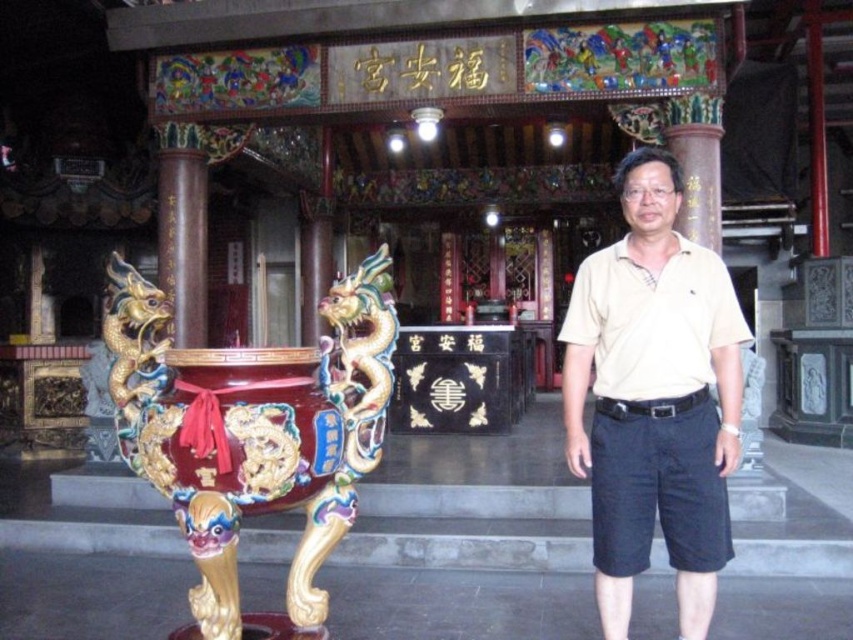
You are a visitor in the temple and want to take a photo of the beige cotton polo shirt at center and the brown polished wood pillar at center. Which object should you focus on first if you want to capture both in a single shot without moving the camera?

The beige cotton polo shirt at center is much taller than the brown polished wood pillar at center, so you should focus on the beige cotton polo shirt at center first to ensure both are in frame.

You are a temple visitor who wants to light an incense stick. The glossy ceramic incense burner at center is your target. However, you need to know if you can reach it without moving past the brown polished wood pillar at center. Your outstretched arm can reach 1.5 meters. Can you reach the burner from your current position near the pillar?

The glossy ceramic incense burner at center is 3.12 meters from the brown polished wood pillar at center. Since your arm can only reach 1.5 meters, you cannot reach the burner without moving closer.

You are a temple visitor holding a large offering tray that is 1 meter wide. You need to place it between the glossy ceramic incense burner at center and the brown polished wood pillar at center. Can you fit the offering tray between them?

The glossy ceramic incense burner at center might be wider than brown polished wood pillar at center, so it is uncertain if the offering tray will fit. Check the actual distance between them before placing the tray.